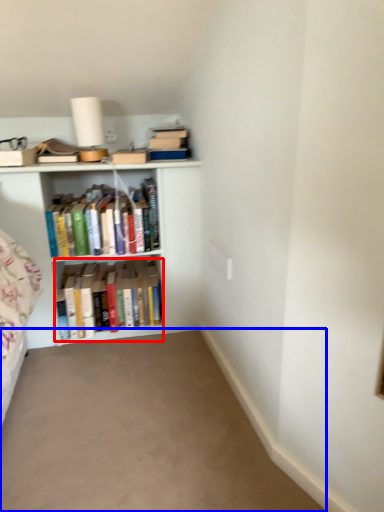
Question: Which object appears farthest to the camera in this image, book (highlighted by a red box) or plain (highlighted by a blue box)?

Choices:
 (A) book
 (B) plain

Answer: (A)